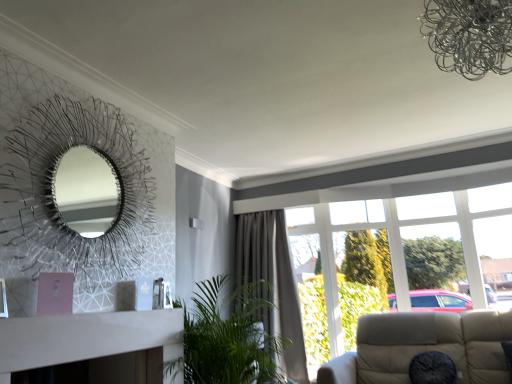
Question: From the image's perspective, is gray fabric curtain at center beneath metallic silver fireplace at left?

Choices:
 (A) no
 (B) yes

Answer: (B)

Question: From a real-world perspective, does gray fabric curtain at center stand above metallic silver fireplace at left?

Choices:
 (A) yes
 (B) no

Answer: (B)

Question: Could you tell me if gray fabric curtain at center is turned towards metallic silver fireplace at left?

Choices:
 (A) no
 (B) yes

Answer: (B)

Question: Is the position of gray fabric curtain at center more distant than that of metallic silver fireplace at left?

Choices:
 (A) yes
 (B) no

Answer: (A)

Question: Is gray fabric curtain at center closer to camera compared to metallic silver fireplace at left?

Choices:
 (A) no
 (B) yes

Answer: (A)

Question: From a real-world perspective, is gray fabric curtain at center located beneath metallic silver fireplace at left?

Choices:
 (A) no
 (B) yes

Answer: (B)

Question: Is gray fabric curtain at center to the right of black fabric cushion at lower right from the viewer's perspective?

Choices:
 (A) yes
 (B) no

Answer: (B)

Question: Is black fabric cushion at lower right a part of gray fabric curtain at center?

Choices:
 (A) yes
 (B) no

Answer: (B)

Question: Would you say gray fabric curtain at center is outside black fabric cushion at lower right?

Choices:
 (A) no
 (B) yes

Answer: (B)

Question: Considering the relative sizes of gray fabric curtain at center and black fabric cushion at lower right in the image provided, is gray fabric curtain at center thinner than black fabric cushion at lower right?

Choices:
 (A) no
 (B) yes

Answer: (A)

Question: Is gray fabric curtain at center shorter than black fabric cushion at lower right?

Choices:
 (A) no
 (B) yes

Answer: (A)

Question: From a real-world perspective, is gray fabric curtain at center beneath black fabric cushion at lower right?

Choices:
 (A) no
 (B) yes

Answer: (A)

Question: Does green leafy plant at center have a smaller size compared to metallic silver fireplace at left?

Choices:
 (A) no
 (B) yes

Answer: (A)